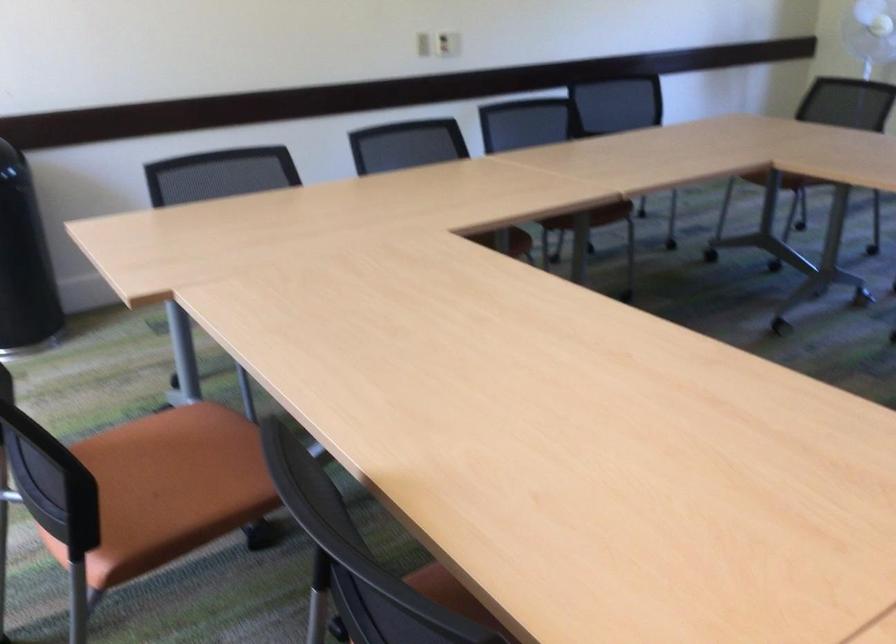
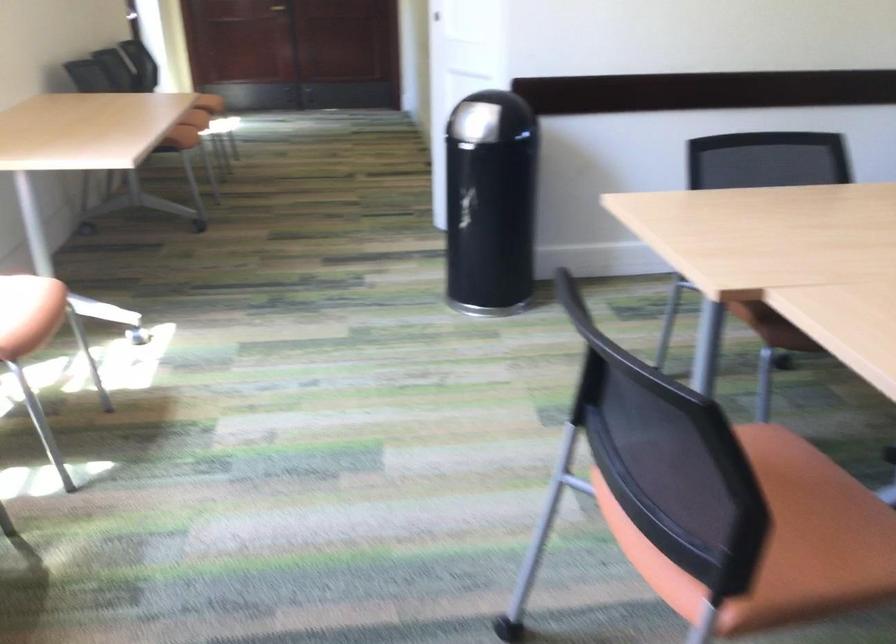
Question: The images are taken continuously from a first-person perspective. In which direction are you moving?

Choices:
 (A) Left
 (B) Right
 (C) Forward
 (D) Backward

Answer: (A)